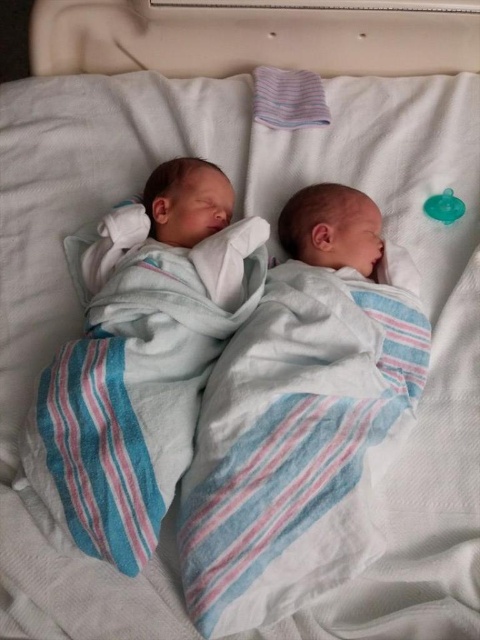
Question: Does white striped swaddle at center have a smaller size compared to white cotton swaddle at center?

Choices:
 (A) no
 (B) yes

Answer: (A)

Question: Which point is closer to the camera?

Choices:
 (A) (408, 381)
 (B) (181, 404)

Answer: (B)

Question: Which of the following is the closest to the observer?

Choices:
 (A) [x=222, y=620]
 (B) [x=137, y=556]

Answer: (A)

Question: Does white striped swaddle at center come behind white cotton swaddle at center?

Choices:
 (A) yes
 (B) no

Answer: (B)

Question: Which of the following is the closest to the observer?

Choices:
 (A) pos(358,486)
 (B) pos(227,204)

Answer: (A)

Question: Does white striped swaddle at center lie behind white cotton swaddle at center?

Choices:
 (A) yes
 (B) no

Answer: (B)